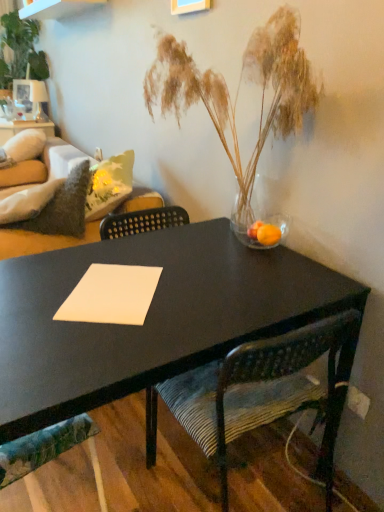
What do you see at coordinates (238, 91) in the screenshot?
I see `translucent glass vase with dried grasses at center` at bounding box center [238, 91].

I want to click on translucent glass vase with dried grasses at center, so click(238, 91).

Measure the distance between point (258,221) and camera.

1.55 meters.

Image resolution: width=384 pixels, height=512 pixels. Find the location of `translucent glass vase at right`. translucent glass vase at right is located at coordinates (264, 233).

Find the location of `green leafy plant at upper left`. green leafy plant at upper left is located at coordinates click(21, 50).

What do you see at coordinates (25, 145) in the screenshot?
I see `white fluffy pillow at upper left` at bounding box center [25, 145].

In order to click on wooden textured chair at center, which is the 1th chair in right-to-left order in this screenshot , I will do `click(255, 393)`.

This screenshot has height=512, width=384. I want to click on couch lying behind the white paper at center, so click(x=42, y=241).

What's the angular difference between velvet green couch at left and white paper at center's facing directions?

The facing directions of velvet green couch at left and white paper at center are 33.7 degrees apart.

Is velvet green couch at left in contact with white paper at center?

No, velvet green couch at left is not touching white paper at center.

Considering the relative sizes of velvet green couch at left and white paper at center in the image provided, is velvet green couch at left wider than white paper at center?

Yes.

Can you confirm if white paper at center is shorter than white fluffy pillow at upper left?

Yes, white paper at center is shorter than white fluffy pillow at upper left.

Is white paper at center smaller than white fluffy pillow at upper left?

Yes, white paper at center is smaller than white fluffy pillow at upper left.

In the scene shown: Would you say white paper at center is a long distance from white fluffy pillow at upper left?

Indeed, white paper at center is not near white fluffy pillow at upper left.

Is the depth of white paper at center less than that of white fluffy pillow at upper left?

That is True.

Is wooden textured chair at center, acting as the 2th chair starting from the left, positioned beyond the bounds of green leafy plant at upper left?

Yes, wooden textured chair at center, acting as the 2th chair starting from the left, is located beyond the bounds of green leafy plant at upper left.

Locate an element on the screen. This screenshot has width=384, height=512. floral arrangement above the wooden textured chair at center, acting as the 2th chair starting from the left (from the image's perspective) is located at coordinates (21, 50).

Which is closer to the camera, (255, 234) or (328, 416)?

Clearly, point (255, 234) is more distant from the camera than point (328, 416).

From the image's perspective, does translucent glass vase at right appear lower than wooden textured chair at center, acting as the 2th chair starting from the left?

Incorrect, from the image's perspective, translucent glass vase at right is higher than wooden textured chair at center, acting as the 2th chair starting from the left.

Which is in front, translucent glass vase at right or wooden textured chair at center, which is the 1th chair in right-to-left order?

wooden textured chair at center, which is the 1th chair in right-to-left order, is closer to the camera.

Is translucent glass vase at right at the left side of wooden textured chair at center, acting as the 2th chair starting from the left?

No, translucent glass vase at right is not to the left of wooden textured chair at center, acting as the 2th chair starting from the left.

Who is shorter, textured fabric chair at lower left, which is counted as the 1th chair, starting from the left, or velvet green couch at left?

textured fabric chair at lower left, which is counted as the 1th chair, starting from the left, is shorter.

Is velvet green couch at left completely or partially inside textured fabric chair at lower left, which is counted as the 1th chair, starting from the left?

No, velvet green couch at left is not a part of textured fabric chair at lower left, which is counted as the 1th chair, starting from the left.

Considering the positions of objects textured fabric chair at lower left, arranged as the second chair when viewed from the right, and velvet green couch at left in the image provided, who is more to the right, textured fabric chair at lower left, arranged as the second chair when viewed from the right, or velvet green couch at left?

textured fabric chair at lower left, arranged as the second chair when viewed from the right.

Is green leafy plant at upper left thinner than velvet green couch at left?

Yes.

Who is more distant, green leafy plant at upper left or velvet green couch at left?

green leafy plant at upper left is further from the camera.

Locate an element on the screen. This screenshot has height=512, width=384. couch in front of the green leafy plant at upper left is located at coordinates (42, 241).

Which is farther from the camera, (1, 51) or (52, 247)?

The point (1, 51) is behind.

Is wooden textured chair at center, acting as the 2th chair starting from the left, not near white fluffy pillow at upper left?

wooden textured chair at center, acting as the 2th chair starting from the left, is positioned a significant distance from white fluffy pillow at upper left.

Considering the sizes of objects wooden textured chair at center, acting as the 2th chair starting from the left, and white fluffy pillow at upper left in the image provided, who is bigger, wooden textured chair at center, acting as the 2th chair starting from the left, or white fluffy pillow at upper left?

Bigger between the two is wooden textured chair at center, acting as the 2th chair starting from the left.

From the image's perspective, is wooden textured chair at center, acting as the 2th chair starting from the left, above or below white fluffy pillow at upper left?

wooden textured chair at center, acting as the 2th chair starting from the left, is situated lower than white fluffy pillow at upper left in the image.

Does point (329, 387) lie in front of point (17, 142)?

Yes, it is in front of point (17, 142).

Identify the location of notepad in front of the velvet green couch at left. (111, 295).

Locate an element on the screen. pillow on the left of white paper at center is located at coordinates (25, 145).

Looking at the image, which one is located closer to velvet green couch at left, translucent glass vase at right or wooden textured chair at center, acting as the 2th chair starting from the left?

translucent glass vase at right lies closer to velvet green couch at left than the other object.

Looking at the image, which one is located further to green leafy plant at upper left, translucent glass vase with dried grasses at center or translucent glass vase at right?

translucent glass vase at right is positioned further to the anchor green leafy plant at upper left.

From the image, which object appears to be nearer to velvet green couch at left, wooden textured chair at center, acting as the 2th chair starting from the left, or translucent glass vase at right?

Based on the image, translucent glass vase at right appears to be nearer to velvet green couch at left.

Looking at this image, looking at the image, which one is located closer to translucent glass vase with dried grasses at center, white paper at center or white fluffy pillow at upper left?

white paper at center.

Which object lies further to the anchor point wooden textured chair at center, acting as the 2th chair starting from the left, white fluffy pillow at upper left or velvet green couch at left?

white fluffy pillow at upper left is further to wooden textured chair at center, acting as the 2th chair starting from the left.

From the image, which object appears to be farther from white fluffy pillow at upper left, wooden textured chair at center, which is the 1th chair in right-to-left order, or translucent glass vase with dried grasses at center?

Among the two, wooden textured chair at center, which is the 1th chair in right-to-left order, is located further to white fluffy pillow at upper left.

When comparing their distances from textured fabric chair at lower left, arranged as the second chair when viewed from the right, does velvet green couch at left or white paper at center seem closer?

white paper at center.

Based on their spatial positions, is green leafy plant at upper left or white paper at center further from white fluffy pillow at upper left?

white paper at center.

This screenshot has height=512, width=384. Find the location of `chair between wooden textured chair at center, which is the 1th chair in right-to-left order, and green leafy plant at upper left, along the z-axis`. chair between wooden textured chair at center, which is the 1th chair in right-to-left order, and green leafy plant at upper left, along the z-axis is located at coordinates (49, 451).

This screenshot has width=384, height=512. In order to click on flower located between white paper at center and green leafy plant at upper left in the depth direction in this screenshot , I will do `click(264, 233)`.

Find the location of a particular element. notepad between translucent glass vase with dried grasses at center and translucent glass vase at right from front to back is located at coordinates (111, 295).

Locate an element on the screen. This screenshot has width=384, height=512. couch positioned between translucent glass vase at right and green leafy plant at upper left from near to far is located at coordinates (42, 241).